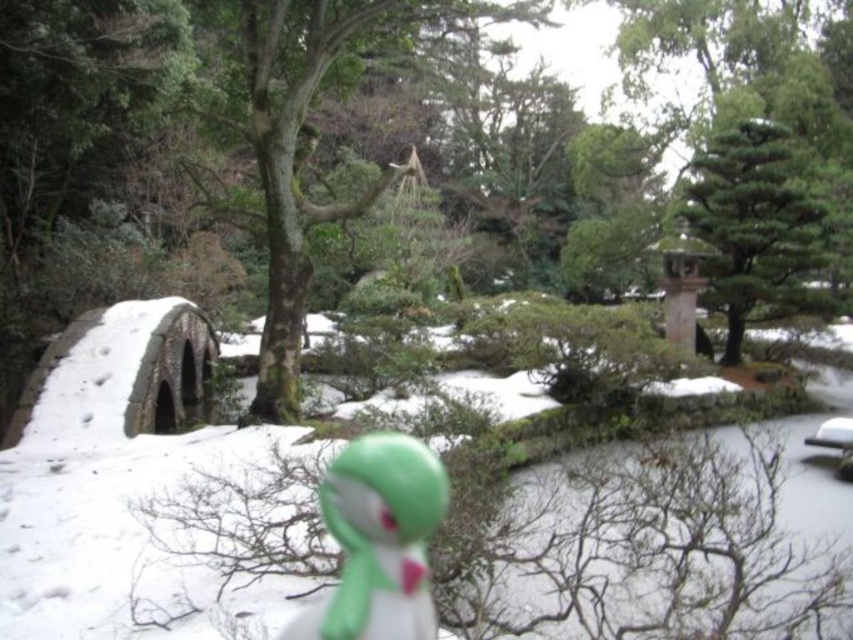
Question: Where is white matte snow at center located in relation to green matte figurine at center in the image?

Choices:
 (A) below
 (B) above

Answer: (B)

Question: Is white matte snow at center wider than green mossy tree at center?

Choices:
 (A) yes
 (B) no

Answer: (B)

Question: Which object is closer to the camera taking this photo?

Choices:
 (A) green matte figurine at center
 (B) green mossy tree at center
 (C) white matte snow at center

Answer: (C)

Question: Does green textured tree at upper right appear under green matte figurine at center?

Choices:
 (A) yes
 (B) no

Answer: (B)

Question: Considering the real-world distances, which object is closest to the white matte snow at center?

Choices:
 (A) green mossy tree at center
 (B) green matte figurine at center

Answer: (B)

Question: Which object is the farthest from the green mossy tree at center?

Choices:
 (A) white matte snow at center
 (B) green matte figurine at center
 (C) green textured tree at upper right

Answer: (A)